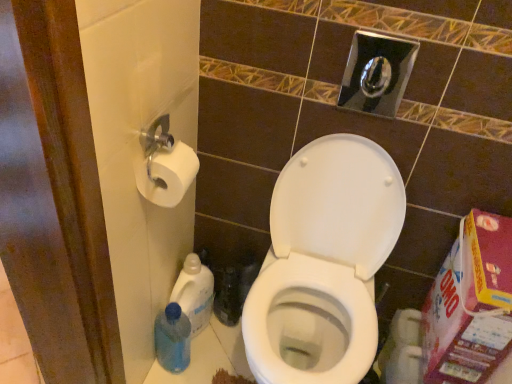
Question: Would you say white glossy toilet at center is inside or outside white matte toilet paper at left?

Choices:
 (A) inside
 (B) outside

Answer: (B)

Question: Looking at the image, does white glossy toilet at center seem bigger or smaller compared to white matte toilet paper at left?

Choices:
 (A) big
 (B) small

Answer: (A)

Question: Estimate the real-world distances between objects in this image. Which object is farther from the white matte toilet paper at left?

Choices:
 (A) blue plastic bottle at lower left, acting as the 1th cleaning product starting from the bottom
 (B) translucent plastic bottle at lower left, acting as the second cleaning product starting from the bottom
 (C) white glossy toilet at center

Answer: (A)

Question: Estimate the real-world distances between objects in this image. Which object is closer to the white matte toilet paper at left?

Choices:
 (A) white glossy toilet at center
 (B) blue plastic bottle at lower left, which ranks as the 2th cleaning product in top-to-bottom order
 (C) translucent plastic bottle at lower left, positioned as the first cleaning product in top-to-bottom order

Answer: (A)